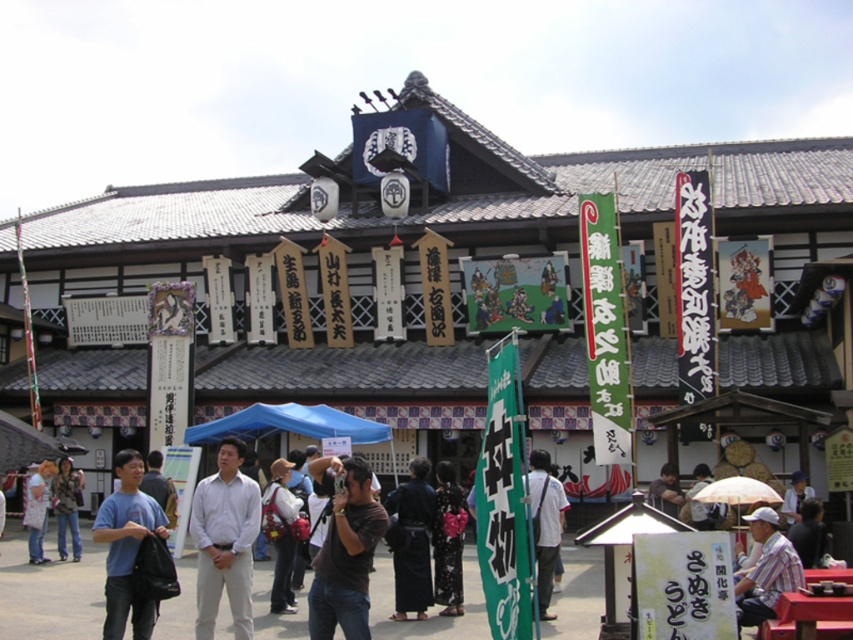
Question: Is black textured kimono at center below camouflage jacket at lower left?

Choices:
 (A) no
 (B) yes

Answer: (A)

Question: Does white cotton shirt at center appear under dark brown fabric camera at center?

Choices:
 (A) yes
 (B) no

Answer: (B)

Question: Is blue fabric canopy at center wider than light blue denim jeans at lower left?

Choices:
 (A) no
 (B) yes

Answer: (B)

Question: Which is nearer to the black textured kimono at center?

Choices:
 (A) white cotton shirt at center
 (B) blue cotton shirt at center
 (C) light blue denim jeans at lower left

Answer: (A)

Question: Which object is positioned closest to the denim jacket at center?

Choices:
 (A) black textured kimono at center
 (B) dark brown fabric camera at center

Answer: (A)

Question: Among these objects, which one is farthest from the camera?

Choices:
 (A) dark brown fabric camera at center
 (B) light blue denim jeans at lower left
 (C) striped cotton shirt at lower right
 (D) blue fabric canopy at center

Answer: (D)